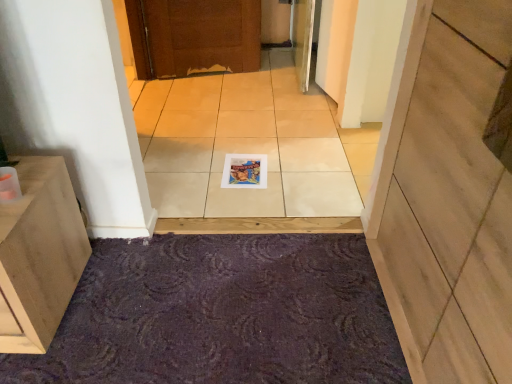
You are a GUI agent. You are given a task and a screenshot of the screen. Output one action in this format:
    pyautogui.click(x=<x>, y=<y>)
    Task: Click on the empty space that is ontop of matte paper magazine at center (from a real-world perspective)
    
    Given the screenshot: What is the action you would take?
    pyautogui.click(x=243, y=163)